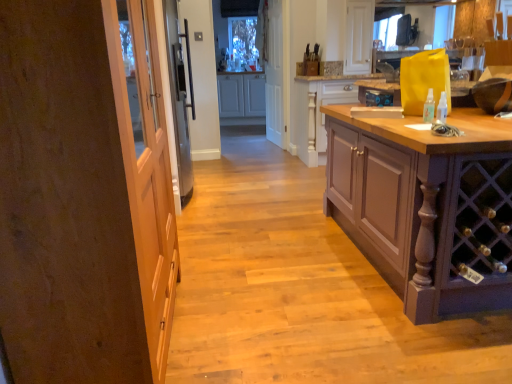
Question: From a real-world perspective, is pale wood cabinet at center, the 2th cabinetry viewed from the front, positioned above or below white matte screen door at center?

Choices:
 (A) above
 (B) below

Answer: (B)

Question: Is point (316, 82) closer or farther from the camera than point (276, 145)?

Choices:
 (A) farther
 (B) closer

Answer: (B)

Question: Which of these objects is positioned farthest from the pale wood cabinet at center, which is counted as the second cabinetry, starting from the back?

Choices:
 (A) purple wood cabinet at right, which ranks as the 1th cabinetry in front-to-back order
 (B) wooden door at left
 (C) white matte cabinet at center, the third cabinetry positioned from the front
 (D) clear plastic spray bottle at right
 (E) white matte screen door at center

Answer: (B)

Question: Which is nearer to the white matte screen door at center?

Choices:
 (A) wooden door at left
 (B) purple wood cabinet at right, placed as the 3th cabinetry when sorted from back to front
 (C) pale wood cabinet at center, the 2th cabinetry viewed from the front
 (D) white matte cabinet at center, the third cabinetry positioned from the front
 (E) clear plastic spray bottle at right

Answer: (D)